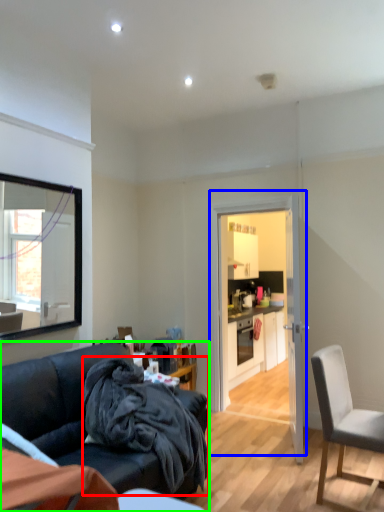
Question: Considering the real-world distances, which object is closest to blanket (highlighted by a red box)? door (highlighted by a blue box) or studio couch (highlighted by a green box).

Choices:
 (A) door
 (B) studio couch

Answer: (B)